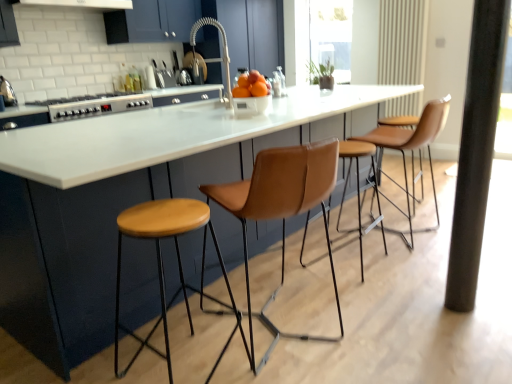
Question: Is leather at center, the second chair when ordered from back to front, thinner than wooden stool at center?

Choices:
 (A) no
 (B) yes

Answer: (A)

Question: Can you confirm if leather at center, which appears as the first chair when viewed from the left, is bigger than wooden stool at center?

Choices:
 (A) no
 (B) yes

Answer: (B)

Question: From a real-world perspective, is leather at center, which is counted as the first chair, starting from the front, located higher than wooden stool at center?

Choices:
 (A) yes
 (B) no

Answer: (A)

Question: Does leather at center, which is counted as the first chair, starting from the front, appear on the right side of wooden stool at center?

Choices:
 (A) no
 (B) yes

Answer: (B)

Question: Is leather at center, which is counted as the first chair, starting from the front, at the left side of wooden stool at center?

Choices:
 (A) no
 (B) yes

Answer: (A)

Question: From the image's perspective, is leather at center, which is counted as the first chair, starting from the front, on wooden stool at center?

Choices:
 (A) no
 (B) yes

Answer: (B)

Question: From the image's perspective, is wooden stool at center above black matte pillar at right?

Choices:
 (A) yes
 (B) no

Answer: (B)

Question: Considering the relative positions of wooden stool at center and black matte pillar at right in the image provided, is wooden stool at center in front of black matte pillar at right?

Choices:
 (A) yes
 (B) no

Answer: (A)

Question: Can you confirm if wooden stool at center is shorter than black matte pillar at right?

Choices:
 (A) yes
 (B) no

Answer: (A)

Question: Can you confirm if wooden stool at center is thinner than black matte pillar at right?

Choices:
 (A) no
 (B) yes

Answer: (A)

Question: Considering the relative sizes of wooden stool at center and black matte pillar at right in the image provided, is wooden stool at center taller than black matte pillar at right?

Choices:
 (A) yes
 (B) no

Answer: (B)

Question: Are wooden stool at center and black matte pillar at right located far from each other?

Choices:
 (A) yes
 (B) no

Answer: (A)

Question: Does transparent glass window screen at upper center have a lesser height compared to silver metallic stove at left?

Choices:
 (A) yes
 (B) no

Answer: (B)